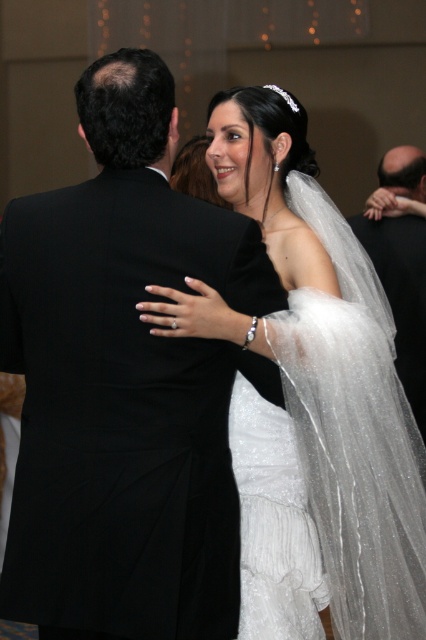
Can you confirm if white satin dress at center is positioned below black satin suit at right?

Indeed, white satin dress at center is positioned under black satin suit at right.

Who is lower down, white satin dress at center or black satin suit at right?

white satin dress at center

Measure the distance between white satin dress at center and camera.

They are 1.54 meters apart.

Where is `white satin dress at center`? Image resolution: width=426 pixels, height=640 pixels. white satin dress at center is located at coordinates pyautogui.click(x=310, y=397).

Is black satin suit at center wider than white tulle dress at center?

Yes, black satin suit at center is wider than white tulle dress at center.

Between black satin suit at center and white tulle dress at center, which one appears on the right side from the viewer's perspective?

white tulle dress at center

Is point (40, 372) in front of point (253, 554)?

Yes.

Locate an element on the screen. The height and width of the screenshot is (640, 426). black satin suit at center is located at coordinates (124, 384).

Who is higher up, white tulle dress at center or black satin suit at right?

black satin suit at right is above.

Is point (239, 438) in front of point (423, 417)?

Yes, point (239, 438) is closer to viewer.

Locate an element on the screen. The height and width of the screenshot is (640, 426). white tulle dress at center is located at coordinates (273, 524).